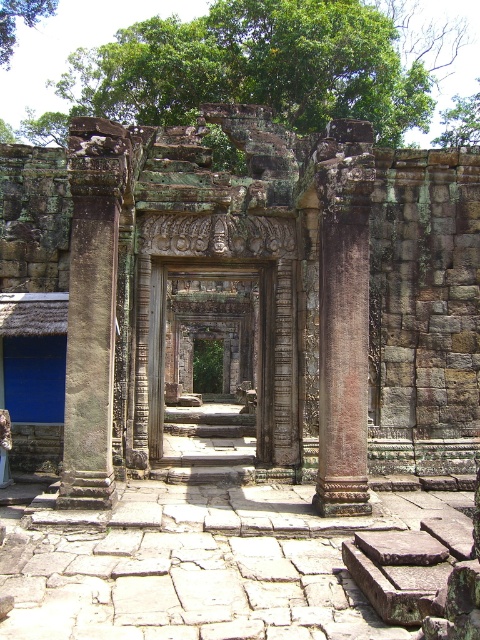
You are standing in front of the ancient stone structure and notice a gray stone column at left and a green leafy tree at upper left. Which object is positioned to the right of the other?

The gray stone column at left is positioned to the right of the green leafy tree at upper left.

You are an archaeologist examining the ancient stone structure. You notice the gray stone column at left and the green leafy tree at upper left. Which object has a smaller diameter?

The gray stone column at left is thinner than the green leafy tree at upper left, so the gray stone column at left has a smaller diameter.